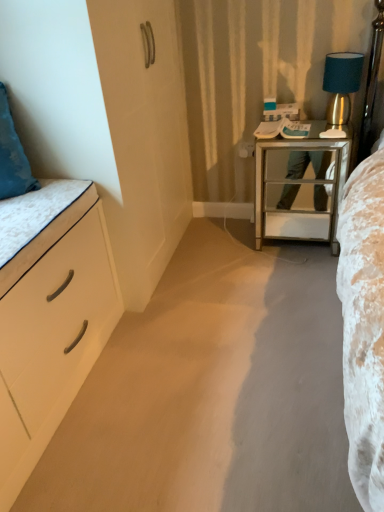
Question: Can you confirm if white matte drawer at left is positioned to the left of white matte chest of drawers at left?

Choices:
 (A) no
 (B) yes

Answer: (A)

Question: From a real-world perspective, does white matte drawer at left stand above white matte chest of drawers at left?

Choices:
 (A) no
 (B) yes

Answer: (B)

Question: Is white matte drawer at left far away from white matte chest of drawers at left?

Choices:
 (A) no
 (B) yes

Answer: (A)

Question: Does white matte drawer at left turn towards white matte chest of drawers at left?

Choices:
 (A) yes
 (B) no

Answer: (B)

Question: Considering the relative sizes of white matte drawer at left and white matte chest of drawers at left in the image provided, is white matte drawer at left taller than white matte chest of drawers at left?

Choices:
 (A) no
 (B) yes

Answer: (A)

Question: Does white matte drawer at left appear on the right side of white matte chest of drawers at left?

Choices:
 (A) yes
 (B) no

Answer: (A)

Question: Could you tell me if white matte chest of drawers at left is facing white matte drawer at left?

Choices:
 (A) yes
 (B) no

Answer: (B)

Question: Is white matte chest of drawers at left thinner than white matte drawer at left?

Choices:
 (A) no
 (B) yes

Answer: (A)

Question: Is white matte chest of drawers at left smaller than white matte drawer at left?

Choices:
 (A) yes
 (B) no

Answer: (B)

Question: Is white matte chest of drawers at left to the right of white matte drawer at left from the viewer's perspective?

Choices:
 (A) yes
 (B) no

Answer: (B)

Question: Does white matte chest of drawers at left contain white matte drawer at left?

Choices:
 (A) no
 (B) yes

Answer: (A)

Question: Is the position of white matte chest of drawers at left more distant than that of white matte drawer at left?

Choices:
 (A) no
 (B) yes

Answer: (A)

Question: From a real-world perspective, is mirrored glass nightstand at center right physically above teal fabric lampshade at upper right?

Choices:
 (A) no
 (B) yes

Answer: (A)